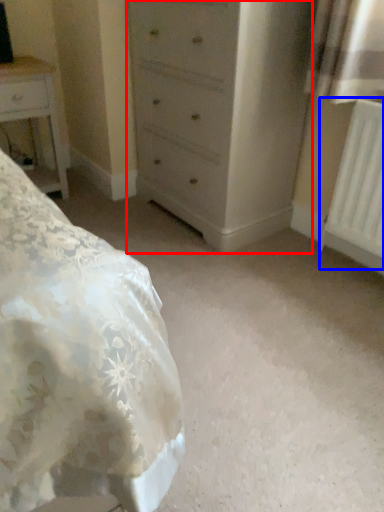
Question: Which point is closer to the camera, chest of drawers (highlighted by a red box) or radiator (highlighted by a blue box)?

Choices:
 (A) chest of drawers
 (B) radiator

Answer: (B)